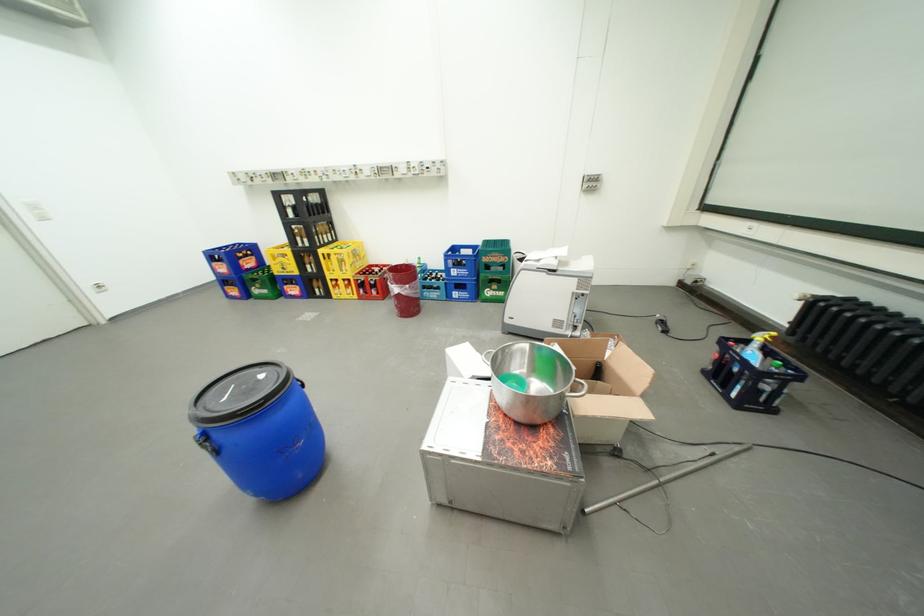
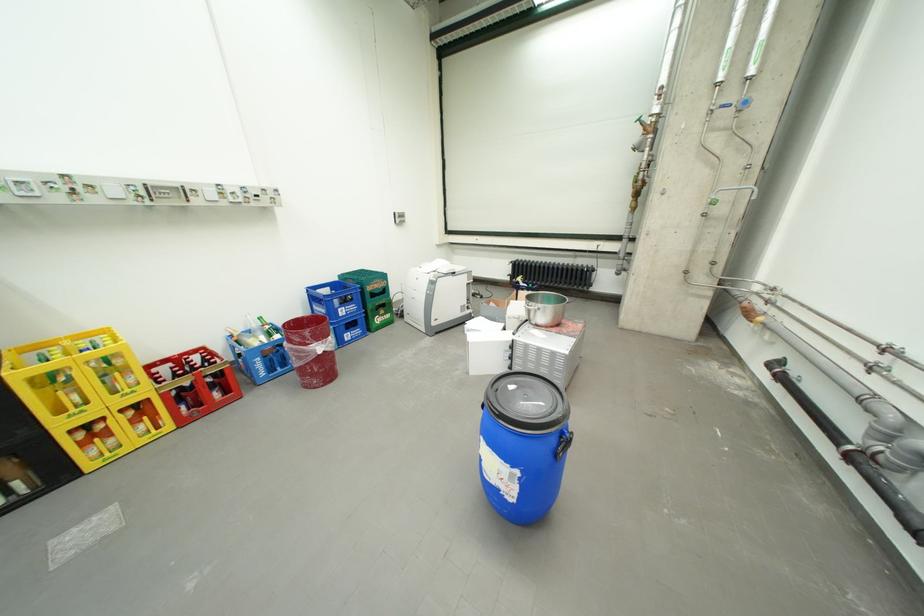
Locate, in the second image, the point that corresponds to (365,282) in the first image.

(172, 397)